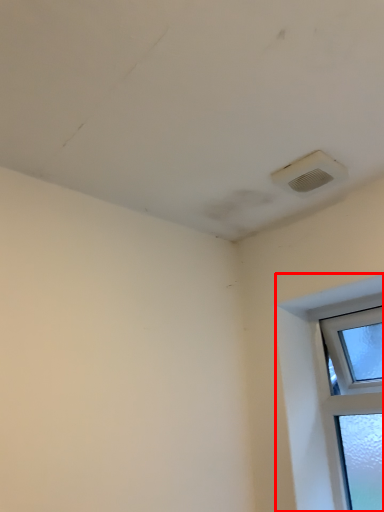
Question: From the image's perspective, what is the correct spatial relationship of window (annotated by the red box) in relation to air conditioning?

Choices:
 (A) above
 (B) below

Answer: (B)